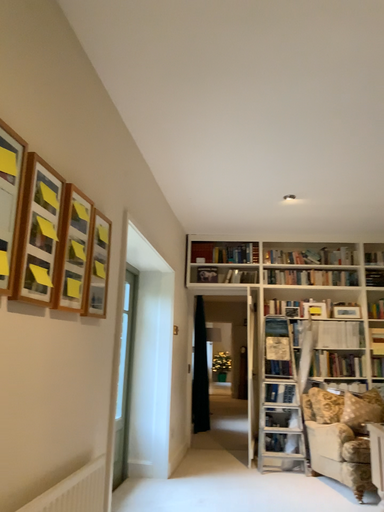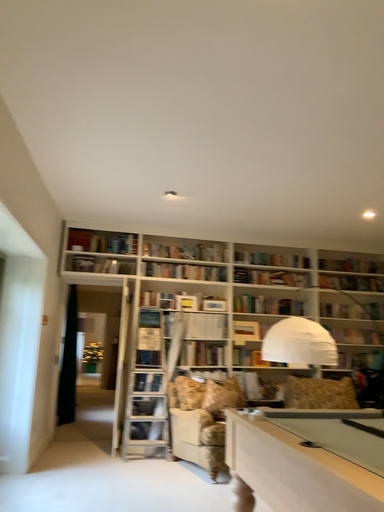
Question: Which way did the camera rotate in the video?

Choices:
 (A) rotated left
 (B) rotated right

Answer: (B)